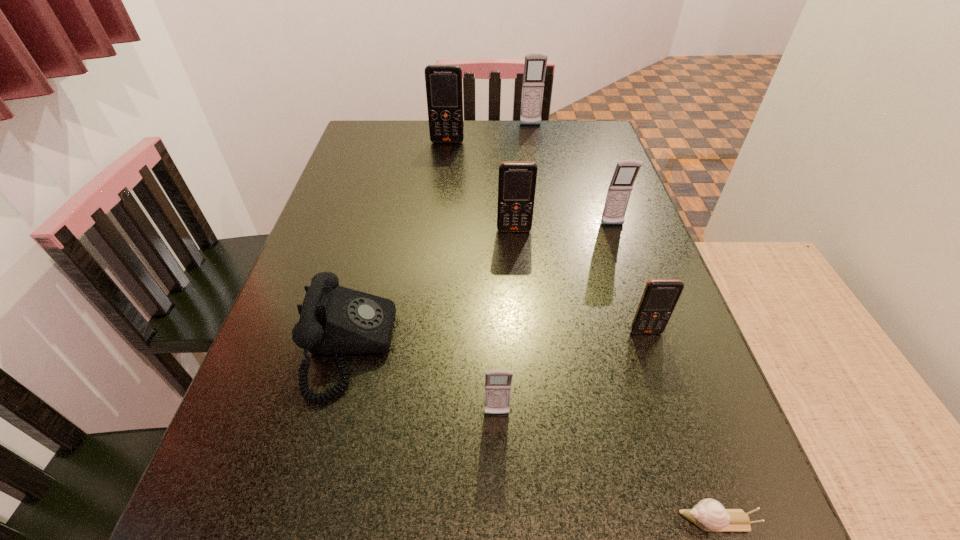
Locate an element on the screen. vacant space at the far edge of the desktop is located at coordinates (457, 145).

Identify the location of vacant space at the left edge. This screenshot has height=540, width=960. (302, 360).

In the image, there is a desktop. In order to click on vacant region at the right edge in this screenshot , I will do `click(577, 164)`.

In the image, there is a desktop. At what (x,y) coordinates should I click in order to perform the action: click on vacant space at the far left corner. Please return your answer as a coordinate pair (x, y). This screenshot has width=960, height=540. Looking at the image, I should click on click(397, 127).

This screenshot has width=960, height=540. In the image, there is a desktop. In order to click on vacant space at the far right corner in this screenshot , I will do `click(557, 138)`.

This screenshot has height=540, width=960. I want to click on empty space that is in between the second smallest gray cellular telephone and the nearest orange cellular telephone, so click(x=629, y=279).

Identify the location of blank region between the nearest object and the second biggest orange cellular telephone. The height and width of the screenshot is (540, 960). tap(615, 375).

Locate an element on the screen. The height and width of the screenshot is (540, 960). free space between the farthest cellular telephone and the leftmost orange cellular telephone is located at coordinates (489, 133).

The image size is (960, 540). Identify the location of blank region between the escargot and the smallest gray cellular telephone. (607, 468).

This screenshot has height=540, width=960. Find the location of `vacant area that lies between the shortest object and the second smallest orange cellular telephone`. vacant area that lies between the shortest object and the second smallest orange cellular telephone is located at coordinates (615, 375).